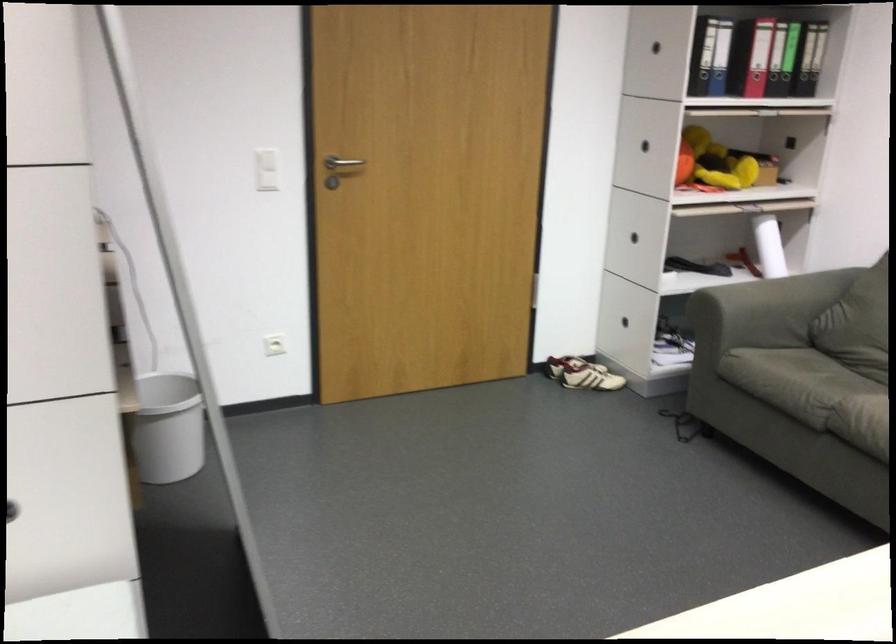
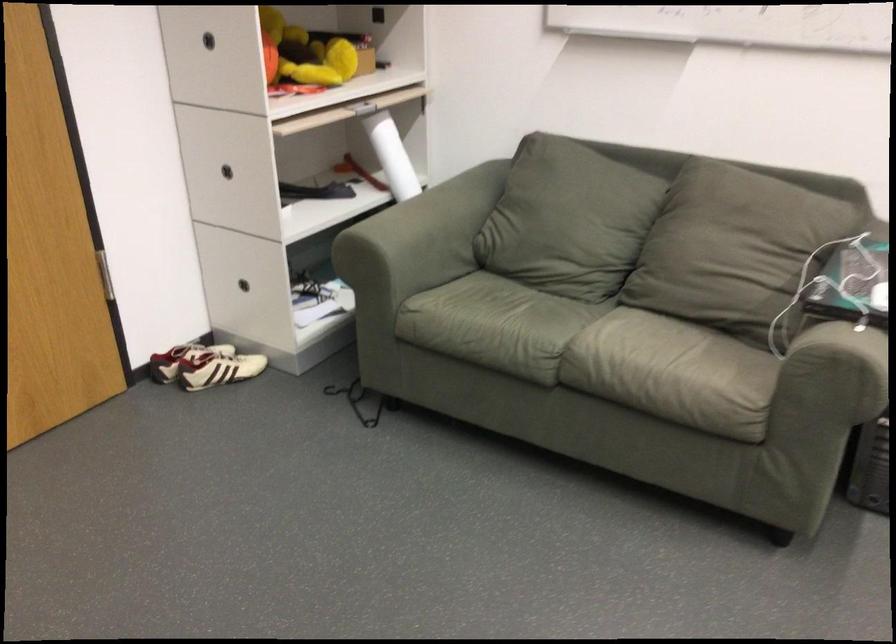
Locate, in the second image, the point that corresponds to point 619,315 in the first image.

(252, 283)